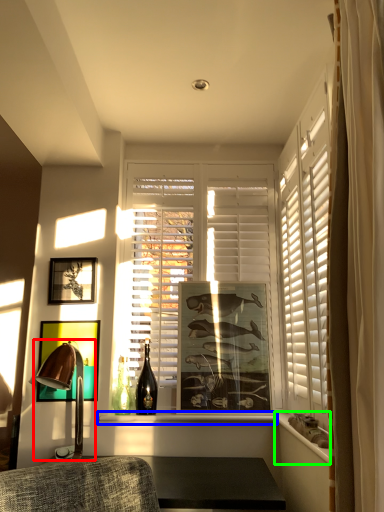
Question: Based on their relative distances, which object is farther from table lamp (highlighted by a red box)? Choose from window sill (highlighted by a blue box) and ledge (highlighted by a green box).

Choices:
 (A) window sill
 (B) ledge

Answer: (B)